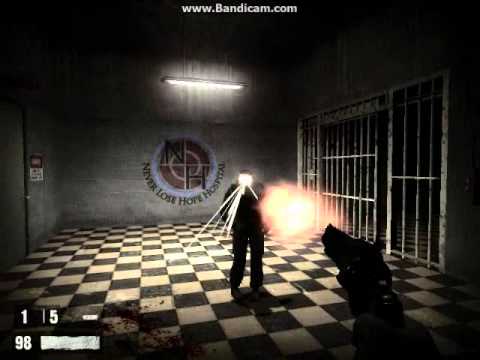
I want to click on solid door, so coord(12,176).